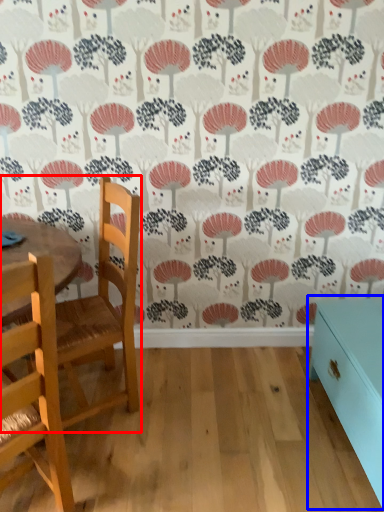
Question: Among these objects, which one is farthest to the camera, chair (highlighted by a red box) or table (highlighted by a blue box)?

Choices:
 (A) chair
 (B) table

Answer: (A)